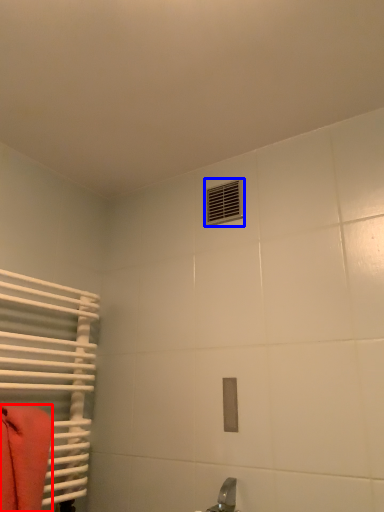
Question: Which object is further to the camera taking this photo, towel (highlighted by a red box) or air conditioning (highlighted by a blue box)?

Choices:
 (A) towel
 (B) air conditioning

Answer: (B)